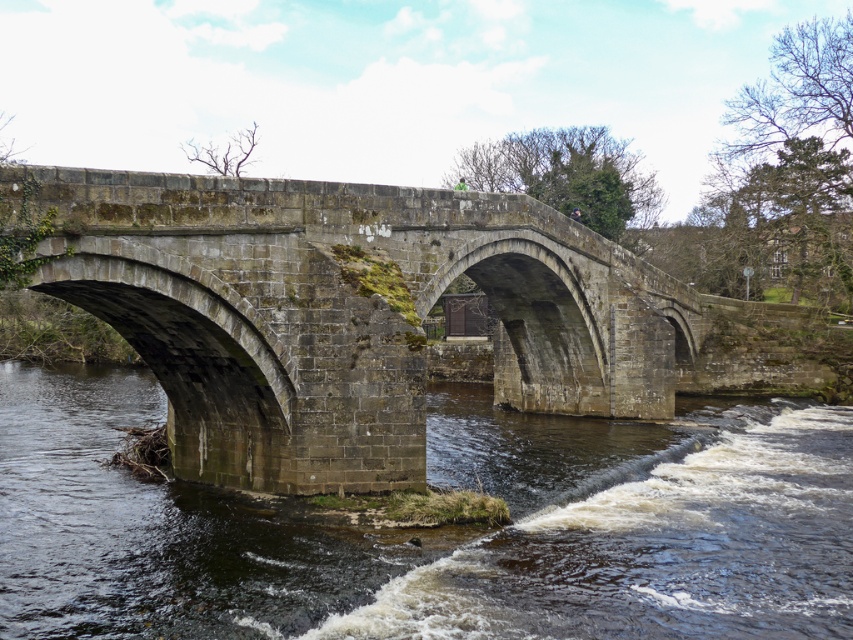
Which is below, dark brown stone river at lower left or stone bridge at center?

dark brown stone river at lower left is below.

Between dark brown stone river at lower left and stone bridge at center, which one appears on the left side from the viewer's perspective?

Positioned to the left is dark brown stone river at lower left.

The image size is (853, 640). I want to click on dark brown stone river at lower left, so click(x=434, y=532).